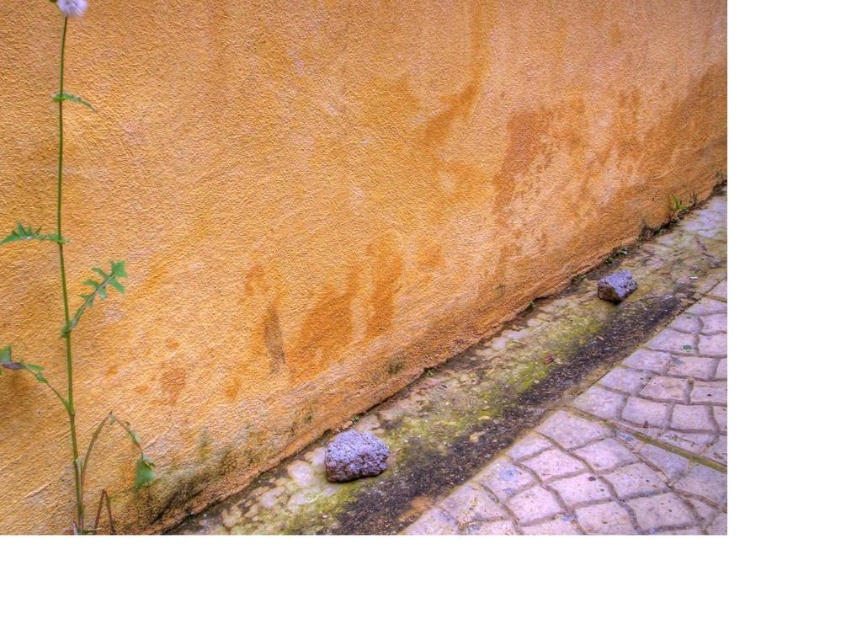
Based on the photo, you are standing on the walkway and looking at the wall. Which object, the gray rough rock at lower right or the white fluffy flower at upper left, is closer to you?

The gray rough rock at lower right is closer to you because the white fluffy flower at upper left is behind it.